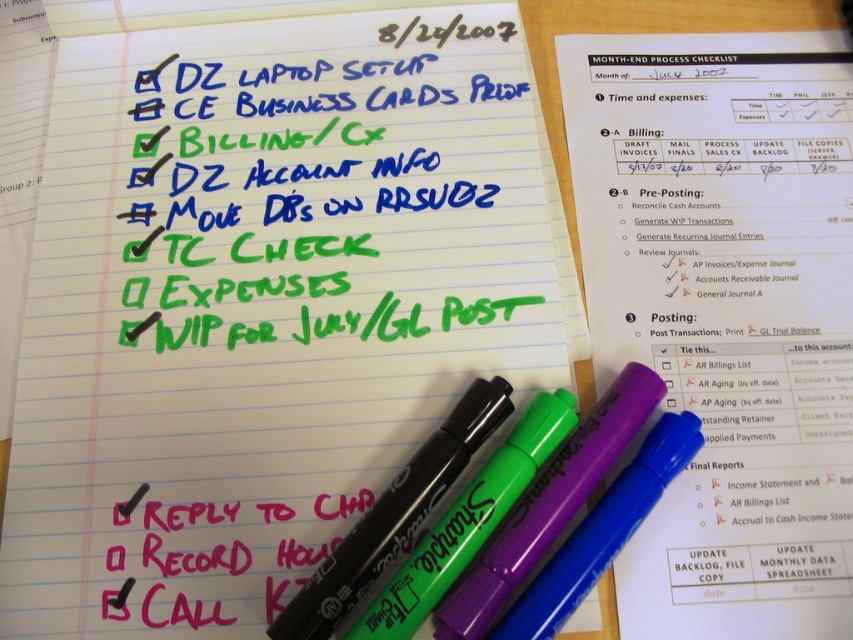
You are organizing a desk and need to place the white lined paper at center and the white paper at upper center. According to the scene, which paper is covering the other?

The white lined paper at center is positioned over the white paper at upper center, so it is covering the other.

You are organizing a desk and need to place a 12 inch ruler between the white lined paper at center and the white paper at upper center. Will the ruler fit between them?

The distance between the white lined paper at center and the white paper at upper center is 10.36 inches, so the 12 inch ruler will not fit between them as it is longer than the available space.